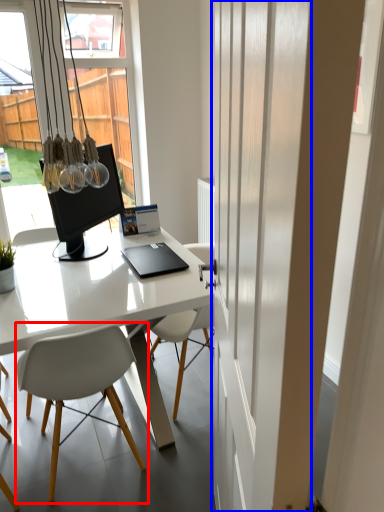
Question: Which of the following is the farthest to the observer, chair (highlighted by a red box) or screen door (highlighted by a blue box)?

Choices:
 (A) chair
 (B) screen door

Answer: (A)